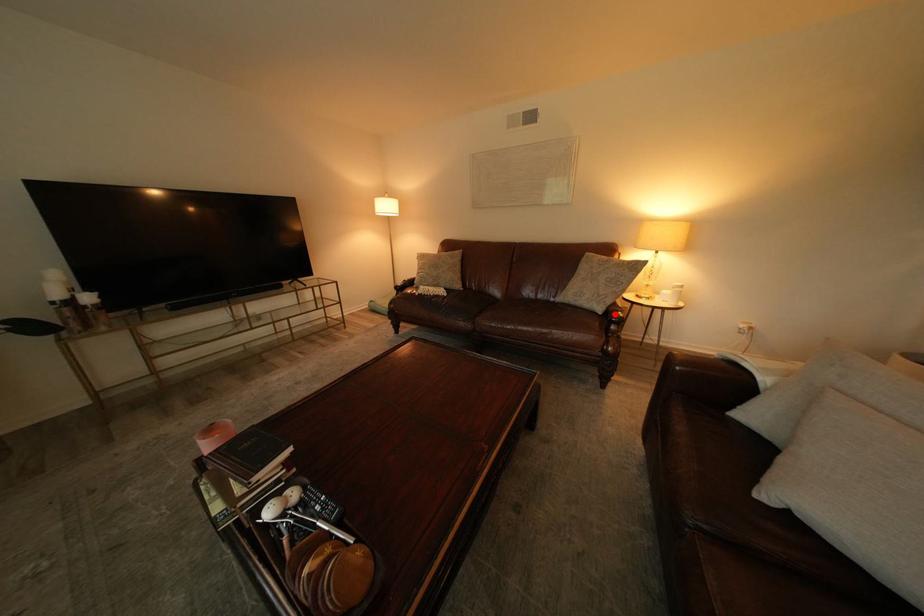
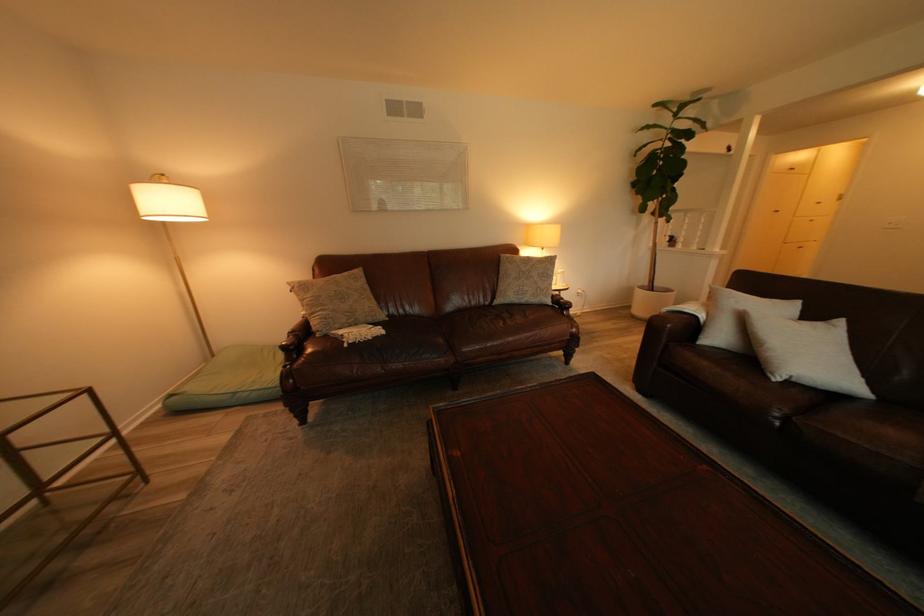
The point at the highlighted location is marked in the first image. Where is the corresponding point in the second image?

(565, 305)